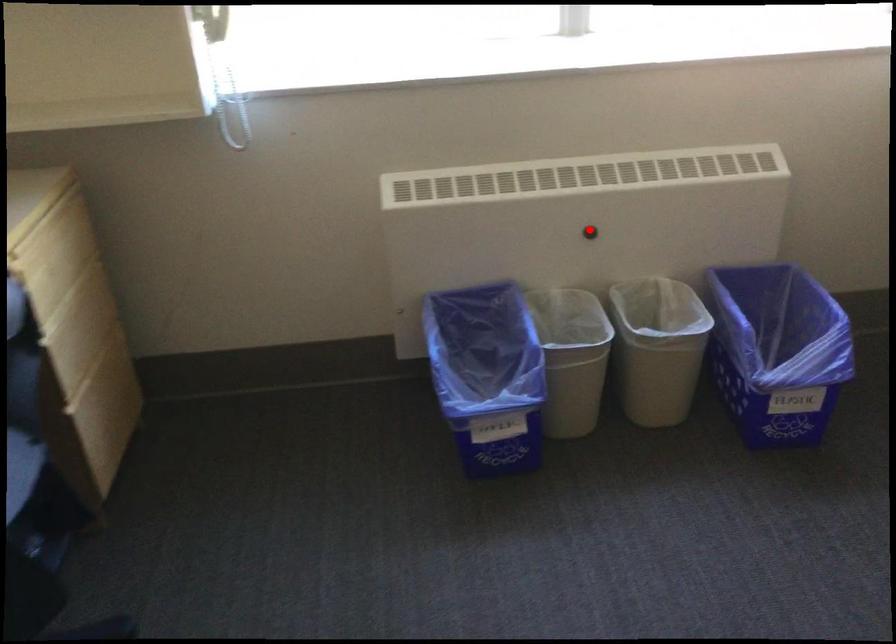
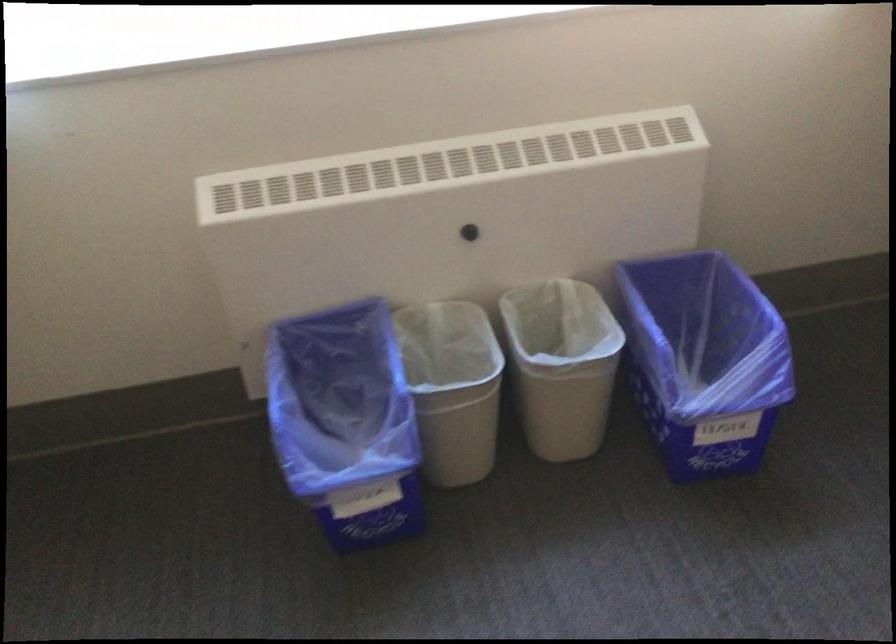
The point at the highlighted location is marked in the first image. Where is the corresponding point in the second image?

(469, 232)